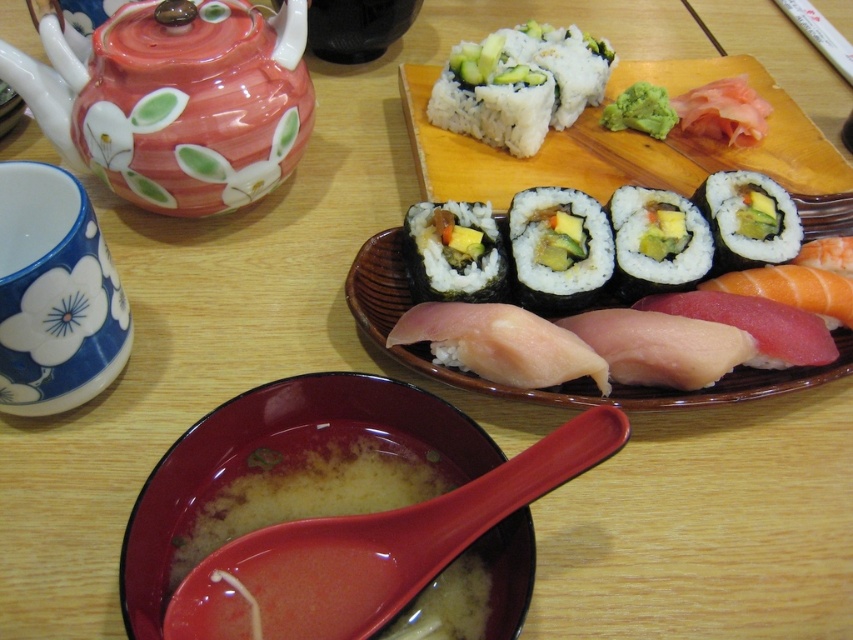
Question: Does matte ceramic bowl at lower center have a smaller size compared to white rice paper at upper right?

Choices:
 (A) yes
 (B) no

Answer: (A)

Question: Is pink raw fish at center bigger than smooth seaweed sushi at center?

Choices:
 (A) no
 (B) yes

Answer: (B)

Question: Which object is farther from the camera taking this photo?

Choices:
 (A) white paper chopstick at upper right
 (B) green nori at center
 (C) white rice paper at upper right

Answer: (A)

Question: Is matte ceramic teapot at upper left thinner than white rice with avocado at upper center?

Choices:
 (A) yes
 (B) no

Answer: (B)

Question: Which point is farther to the camera?

Choices:
 (A) (450, 120)
 (B) (734, 173)
 (C) (527, 193)
 (D) (576, 396)

Answer: (A)

Question: Which of these objects is positioned farthest from the smooth seaweed sushi at center?

Choices:
 (A) green nori at center
 (B) pink raw fish at center
 (C) smooth avocado sushi at center

Answer: (C)